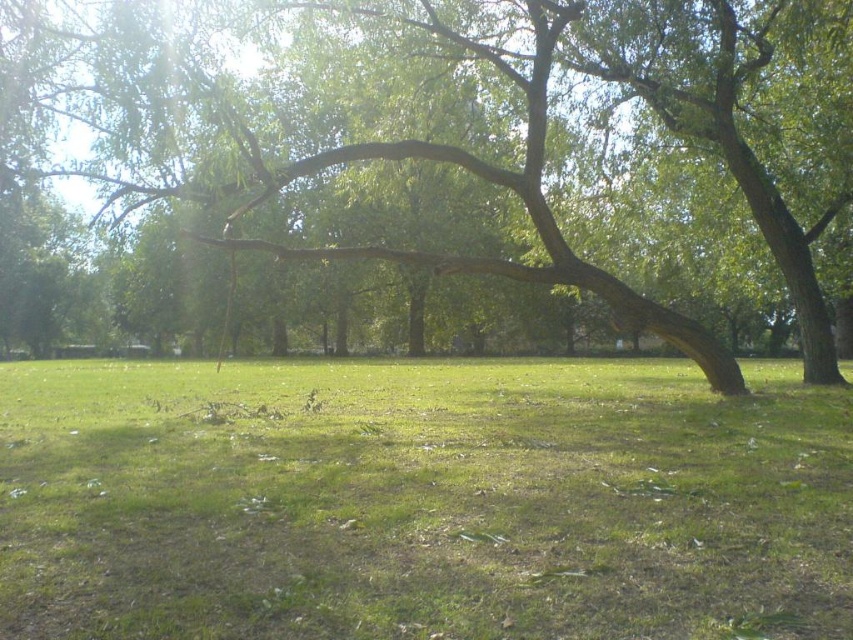
Who is taller, green grass at center or green rough bark tree at center?

Standing taller between the two is green rough bark tree at center.

Is green grass at center bigger than green rough bark tree at center?

No, green grass at center is not bigger than green rough bark tree at center.

Is point (270, 438) more distant than point (555, 240)?

No, it is not.

Find the location of a particular element. Image resolution: width=853 pixels, height=640 pixels. green grass at center is located at coordinates (421, 500).